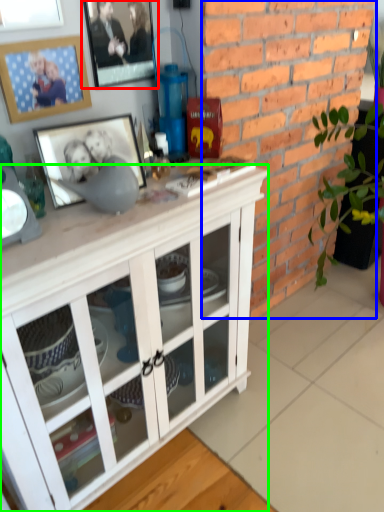
Question: Estimate the real-world distances between objects in this image. Which object is closer to picture frame (highlighted by a red box), brickwork (highlighted by a blue box) or cabinetry (highlighted by a green box)?

Choices:
 (A) brickwork
 (B) cabinetry

Answer: (A)